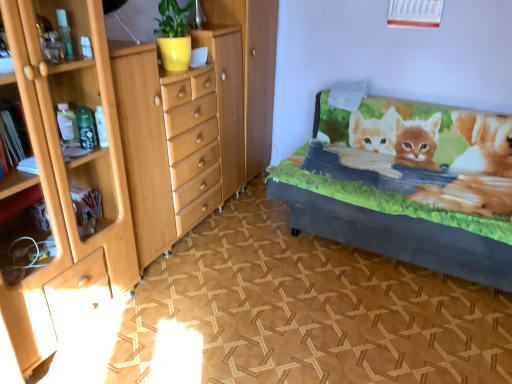
Locate an element on the screen. The height and width of the screenshot is (384, 512). vacant space in front of velvet gray bed frame at right is located at coordinates (386, 332).